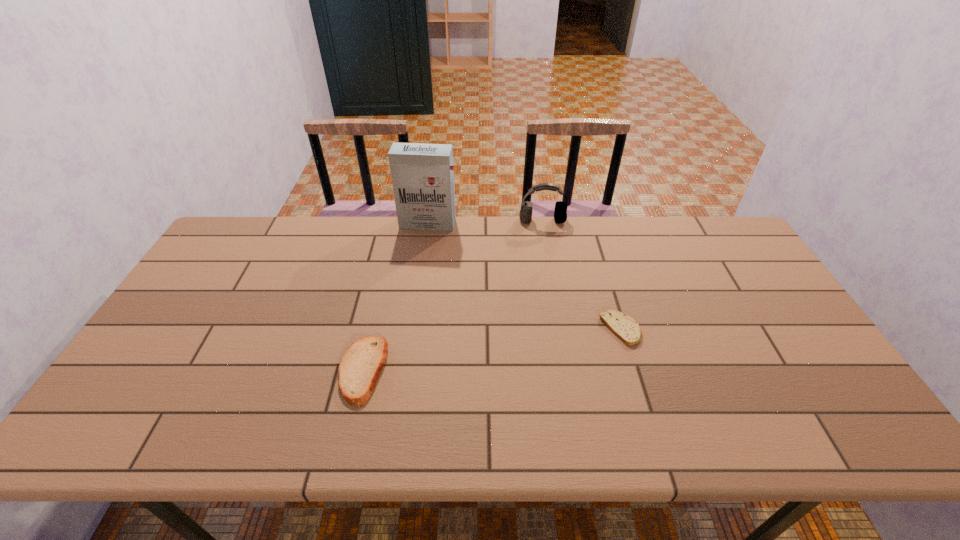
The width and height of the screenshot is (960, 540). I want to click on vacant area located 0.110m on the back of the shortest object, so coord(608,286).

Where is `cigarette case positioned at the far edge`? cigarette case positioned at the far edge is located at coordinates (422, 175).

This screenshot has width=960, height=540. Identify the location of headset that is at the far edge. (560, 213).

Locate an element on the screen. vacant region at the far edge of the desktop is located at coordinates (388, 220).

You are a GUI agent. You are given a task and a screenshot of the screen. Output one action in this format:
    pyautogui.click(x=<x>, y=<y>)
    Task: Click on the vacant space at the near edge of the desktop
    The image size is (960, 540).
    Given the screenshot: What is the action you would take?
    pyautogui.click(x=581, y=445)

Where is `vacant space at the left edge of the desktop`? This screenshot has height=540, width=960. vacant space at the left edge of the desktop is located at coordinates (216, 320).

In the image, there is a desktop. What are the coordinates of `vacant space at the right edge` in the screenshot? It's located at (730, 283).

This screenshot has height=540, width=960. What are the coordinates of `free space at the far left corner of the desktop` in the screenshot? It's located at (228, 233).

Find the location of a particular element. This screenshot has width=960, height=540. vacant space at the far right corner of the desktop is located at coordinates (x=706, y=228).

I want to click on vacant point located between the tallest object and the headset, so (485, 222).